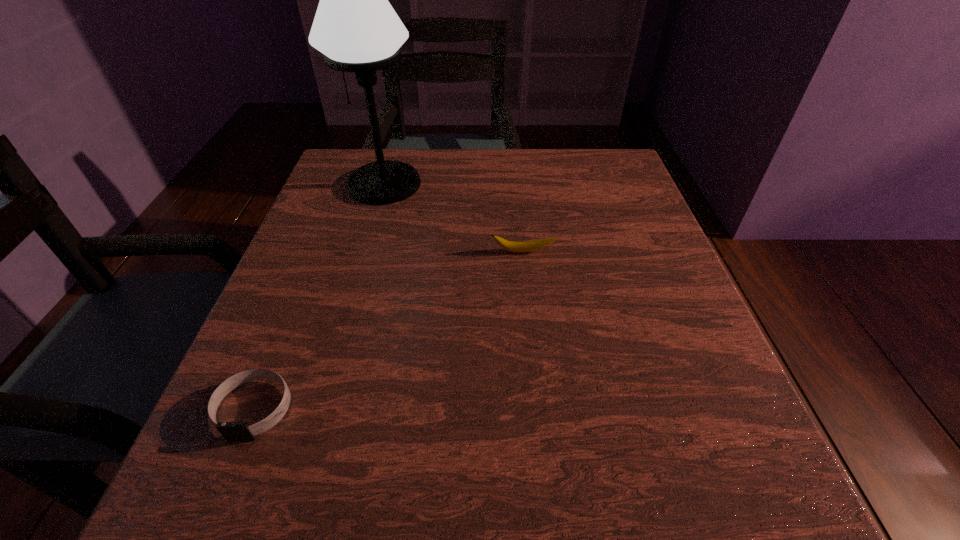
Locate an element on the screen. free space between the tallest object and the rightmost object is located at coordinates (454, 218).

Find the location of `unoccupied position between the table lamp and the nearest object`. unoccupied position between the table lamp and the nearest object is located at coordinates (320, 296).

The image size is (960, 540). Find the location of `free space between the farthest object and the rightmost object`. free space between the farthest object and the rightmost object is located at coordinates (454, 218).

This screenshot has width=960, height=540. I want to click on vacant area between the tallest object and the wristband, so click(320, 296).

Where is `vacant space that is in between the wristband and the farthest object`? This screenshot has height=540, width=960. vacant space that is in between the wristband and the farthest object is located at coordinates (320, 296).

Where is `free point between the second nearest object and the table lamp`? The height and width of the screenshot is (540, 960). free point between the second nearest object and the table lamp is located at coordinates (454, 218).

I want to click on blank region between the nearest object and the farthest object, so click(320, 296).

Identify which object is the second closest to the nearest object. Please provide its 2D coordinates. Your answer should be formatted as a tuple, i.e. [(x, y)], where the tuple contains the x and y coordinates of a point satisfying the conditions above.

[(355, 27)]

Where is `the closest object to the wristband`? This screenshot has height=540, width=960. the closest object to the wristband is located at coordinates (519, 247).